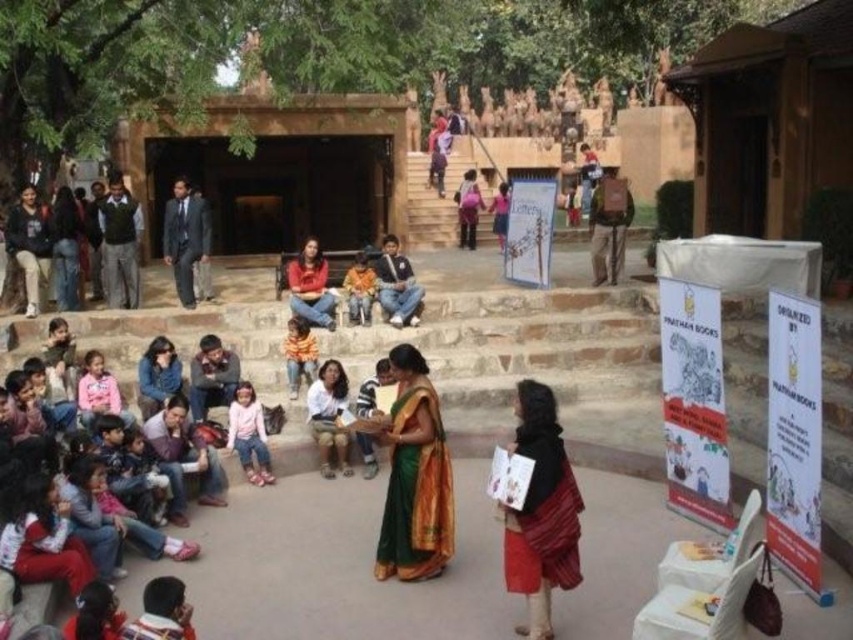
Question: Does pink fabric pants at lower center have a smaller size compared to denim jeans at center?

Choices:
 (A) yes
 (B) no

Answer: (A)

Question: Which of these objects is positioned closest to the pink fabric pants at lower center?

Choices:
 (A) denim jeans at center
 (B) red silk sari at lower right
 (C) orange cotton sweater at center

Answer: (C)

Question: Considering the real-world distances, which object is closest to the denim jeans at center?

Choices:
 (A) pink fabric pants at lower center
 (B) white cotton shirt at center
 (C) red silk sari at lower right
 (D) orange cotton sweater at center

Answer: (D)

Question: Which of the following is the closest to the observer?

Choices:
 (A) (254, 360)
 (B) (321, 369)

Answer: (B)

Question: Does orange cotton sweater at center appear on the right side of orange cotton shirt at center?

Choices:
 (A) no
 (B) yes

Answer: (A)

Question: Is red silk sari at lower right to the right of denim jeans at center from the viewer's perspective?

Choices:
 (A) no
 (B) yes

Answer: (B)